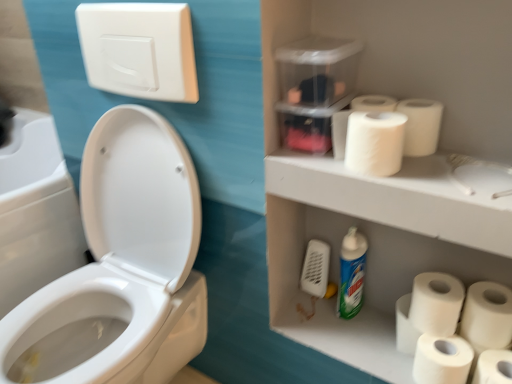
Question: In terms of height, does white matte toilet paper at lower right, the 3th toilet paper ordered from the bottom, look taller or shorter compared to white matte toilet paper at upper right, which appears as the 2th toilet paper when viewed from the top?

Choices:
 (A) tall
 (B) short

Answer: (A)

Question: From the image's perspective, is white matte toilet paper at lower right, positioned as the 4th toilet paper in top-to-bottom order, positioned above or below white matte toilet paper at upper right, which appears as the 2th toilet paper when viewed from the top?

Choices:
 (A) below
 (B) above

Answer: (A)

Question: Considering the real-world distances, which object is farthest from the white matte toilet paper at lower right, which appears as the fourth toilet paper when ordered from the bottom?

Choices:
 (A) white matte toilet paper at lower right, positioned as the 4th toilet paper in top-to-bottom order
 (B) white matte paper towel at upper right
 (C) white matte toilet paper at upper right, which appears as the 2th toilet paper when viewed from the top
 (D) white matte toilet paper at upper right, which ranks as the sixth toilet paper in bottom-to-top order
 (E) white glossy cleaning product at lower center

Answer: (B)

Question: Which is nearer to the white matte toilet paper at upper right, which appears as the 5th toilet paper when ordered from the bottom?

Choices:
 (A) white glossy toilet at left
 (B) white matte paper towel at upper right
 (C) white matte toilet paper at upper right, the 1th toilet paper from the top
 (D) white matte toilet paper at lower right, acting as the second toilet paper starting from the bottom
 (E) transparent plastic toiletry box at upper center

Answer: (B)